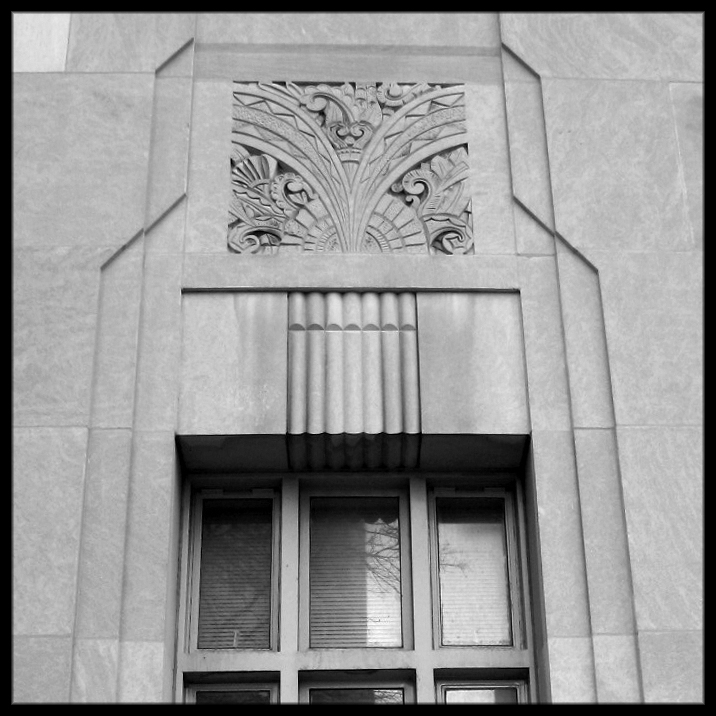
Where is `scrollwork`? This screenshot has height=716, width=716. scrollwork is located at coordinates (281, 203).